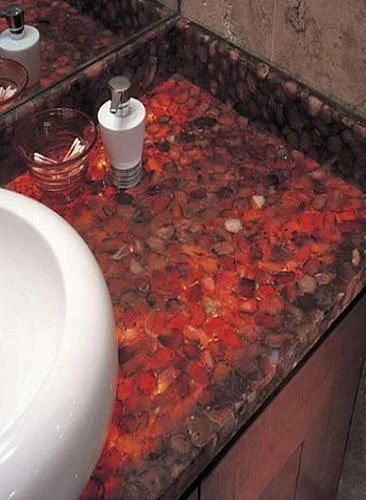
At what (x,y) coordinates should I click in order to perform the action: click on glass. Please return your answer as a coordinate pair (x, y). The width and height of the screenshot is (366, 500). Looking at the image, I should click on (69, 177).